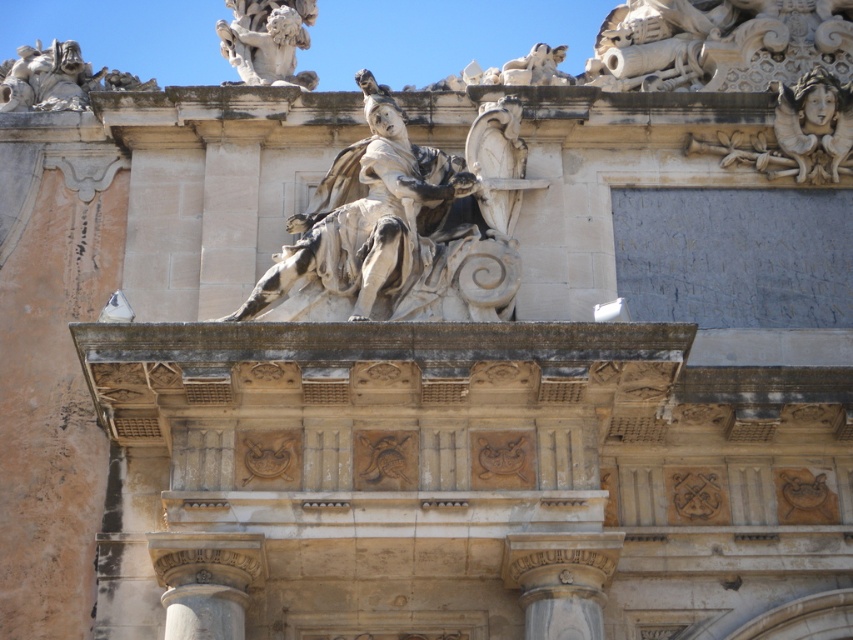
Question: Does white marble statue at center appear on the right side of white marble column at center?

Choices:
 (A) yes
 (B) no

Answer: (B)

Question: From the image, what is the correct spatial relationship of white marble statue at center in relation to white stone cherub at upper left?

Choices:
 (A) right
 (B) left

Answer: (A)

Question: Does white marble column at center have a smaller size compared to smooth stone column at lower left?

Choices:
 (A) yes
 (B) no

Answer: (A)

Question: Estimate the real-world distances between objects in this image. Which object is closer to the white marble statue at center?

Choices:
 (A) white stone cherub at upper left
 (B) white marble column at center

Answer: (A)

Question: Which object is the farthest from the white stone cherub at upper left?

Choices:
 (A) smooth stone column at lower left
 (B) white marble column at center

Answer: (B)

Question: Which of the following is the farthest from the observer?

Choices:
 (A) white marble statue at center
 (B) white stone cherub at upper left
 (C) white marble column at center

Answer: (B)